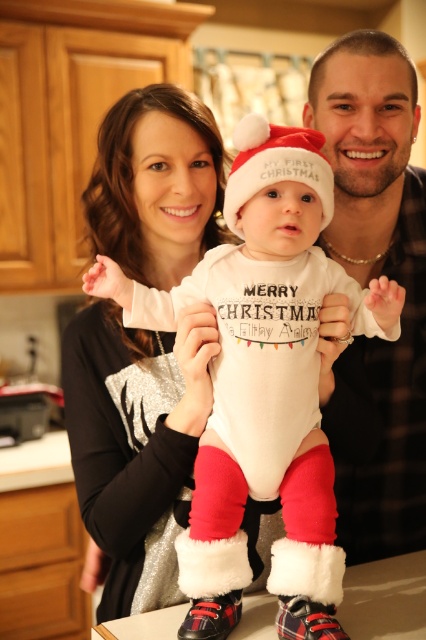
You are a photographer trying to capture the perfect shot of the baby in the white cotton onesie at center. To ensure the best lighting, you need to position the camera so that the onesie is directly under the main light source. Given the coordinates of the onesie, where should you place the camera to align the light correctly?

The white cotton onesie at center is located at coordinates point (262, 499). To align the light correctly, position the camera so that the main light source is directly above these coordinates.

You are a photographer trying to decide which clothing item to focus on in the image. Both the matte silver sweater at center and the matte black shirt at center are in the frame. Which one should you zoom in on if you want to capture the larger item?

The matte silver sweater at center is larger in size than the matte black shirt at center, so you should zoom in on the matte silver sweater at center to capture the larger item.